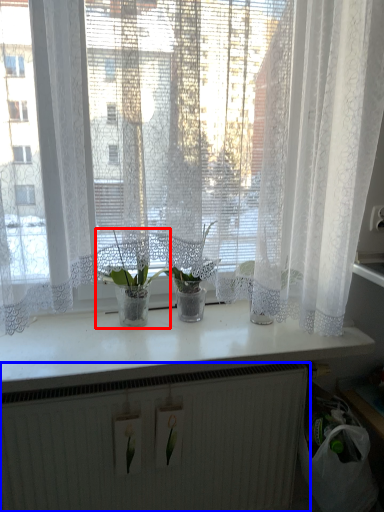
Question: Which of the following is the closest to the observer, houseplant (highlighted by a red box) or radiator (highlighted by a blue box)?

Choices:
 (A) houseplant
 (B) radiator

Answer: (B)